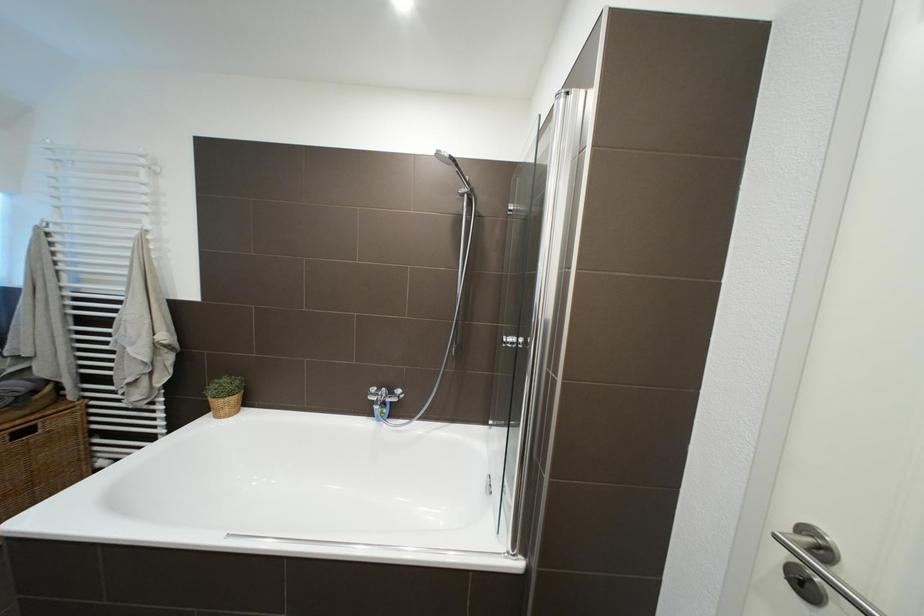
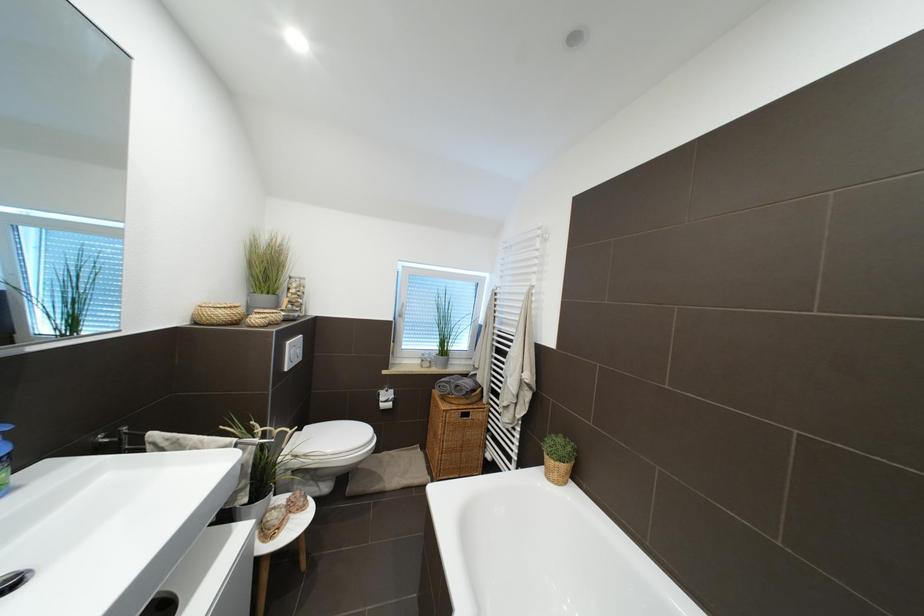
Question: The first image is from the beginning of the video and the second image is from the end. How did the camera likely rotate when shooting the video?

Choices:
 (A) Left
 (B) Right
 (C) Up
 (D) Down

Answer: (A)